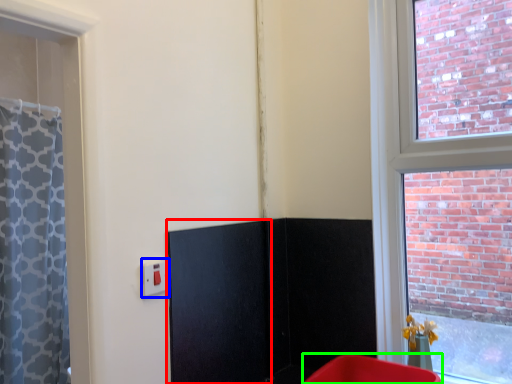
Question: Which object is positioned farthest from screen door (highlighted by a red box)? Select from electric outlet (highlighted by a blue box) and furniture (highlighted by a green box).

Choices:
 (A) electric outlet
 (B) furniture

Answer: (B)